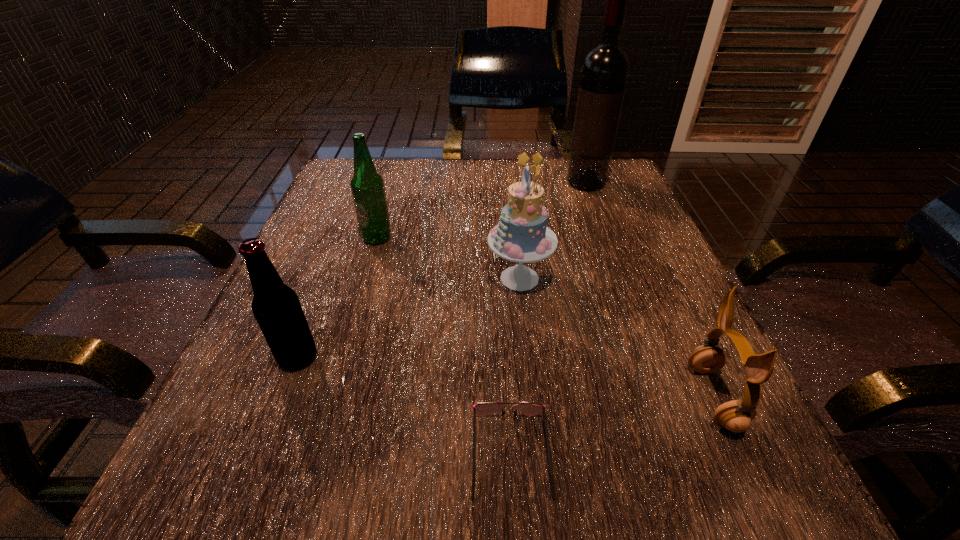
The height and width of the screenshot is (540, 960). What are the coordinates of `wine bottle located at the right edge` in the screenshot? It's located at (604, 73).

You are a GUI agent. You are given a task and a screenshot of the screen. Output one action in this format:
    pyautogui.click(x=<x>, y=<y>)
    Task: Click on the earphone at the right edge
    
    Given the screenshot: What is the action you would take?
    pyautogui.click(x=736, y=415)

Locate an element on the screen. This screenshot has width=960, height=540. object that is at the far right corner is located at coordinates (604, 73).

In the image, there is a desktop. Identify the location of vacant space at the far edge. (462, 200).

Where is `vacant space at the near edge`? Image resolution: width=960 pixels, height=540 pixels. vacant space at the near edge is located at coordinates (562, 479).

Where is `vacant position at the left edge of the desktop`? Image resolution: width=960 pixels, height=540 pixels. vacant position at the left edge of the desktop is located at coordinates (339, 348).

You are a GUI agent. You are given a task and a screenshot of the screen. Output one action in this format:
    pyautogui.click(x=<x>, y=<y>)
    Task: Click on the vacant space at the right edge of the desktop
    This screenshot has width=960, height=540.
    Given the screenshot: What is the action you would take?
    pyautogui.click(x=656, y=233)

At what (x,y) coordinates should I click in order to perform the action: click on vacant space at the far left corner of the desktop. Please return your answer as a coordinate pair (x, y). This screenshot has width=960, height=540. Looking at the image, I should click on (329, 208).

Find the location of a particular element. The height and width of the screenshot is (540, 960). blank region between the sunglasses and the nearer beer bottle is located at coordinates (404, 406).

The image size is (960, 540). I want to click on vacant area that lies between the farther beer bottle and the shortest object, so click(444, 346).